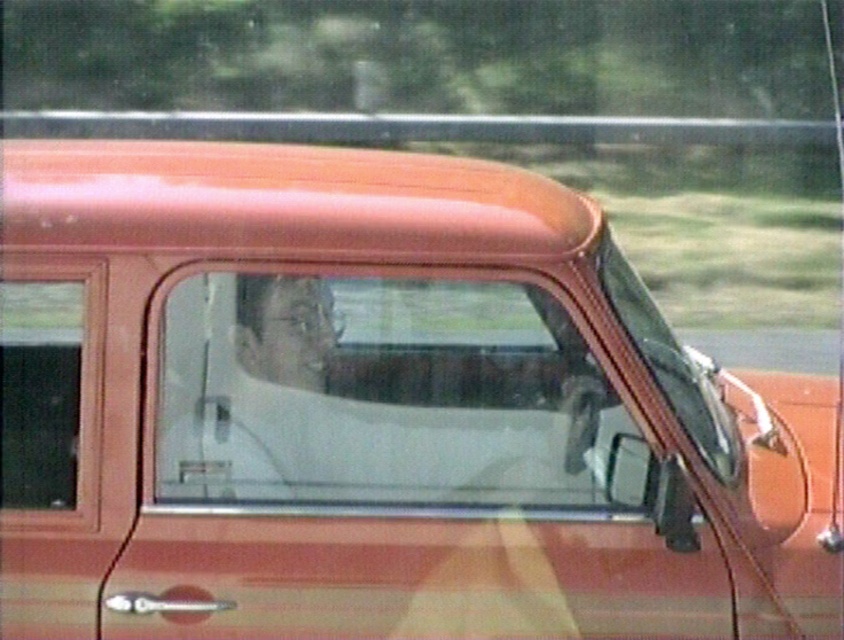
Who is positioned more to the right, clear glass window at center or transparent glass window at left?

Positioned to the right is clear glass window at center.

Does clear glass window at center have a greater height compared to transparent glass window at left?

Yes, clear glass window at center is taller than transparent glass window at left.

Looking at this image, who is more distant from viewer, (283, 461) or (88, 497)?

The point (283, 461) is behind.

Image resolution: width=844 pixels, height=640 pixels. What are the coordinates of `clear glass window at center` in the screenshot? It's located at (387, 396).